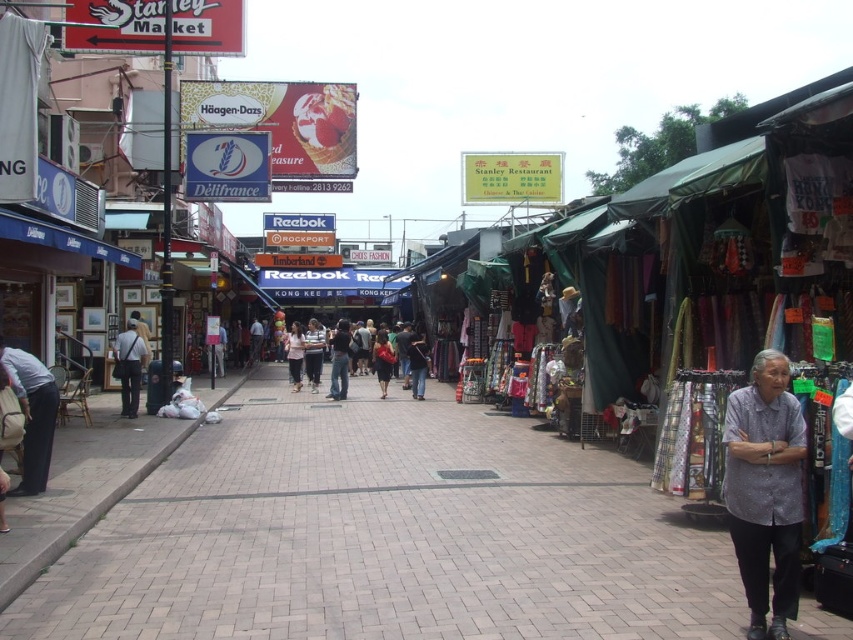
Does red fabric bag at center come behind white cotton shirt at center?

No, red fabric bag at center is in front of white cotton shirt at center.

Can you confirm if red fabric bag at center is positioned to the left of white cotton shirt at center?

In fact, red fabric bag at center is to the right of white cotton shirt at center.

Who is more distant from viewer, (384, 356) or (300, 349)?

The point (300, 349) is more distant.

Identify the location of red fabric bag at center. (381, 360).

Who is higher up, light blue jeans at center or red fabric bag at center?

light blue jeans at center is above.

At what (x,y) coordinates should I click in order to perform the action: click on light blue jeans at center. Please return your answer as a coordinate pair (x, y). The height and width of the screenshot is (640, 853). Looking at the image, I should click on (312, 353).

Locate an element on the screen. The height and width of the screenshot is (640, 853). light blue jeans at center is located at coordinates (312, 353).

Is brick pavement at center smaller than purple cotton shirt at lower right?

Actually, brick pavement at center might be larger than purple cotton shirt at lower right.

Is brick pavement at center below purple cotton shirt at lower right?

Indeed, brick pavement at center is positioned under purple cotton shirt at lower right.

Does point (376, 608) come farther from viewer compared to point (740, 572)?

Yes, point (376, 608) is farther from viewer.

Where is `brick pavement at center`? brick pavement at center is located at coordinates (386, 536).